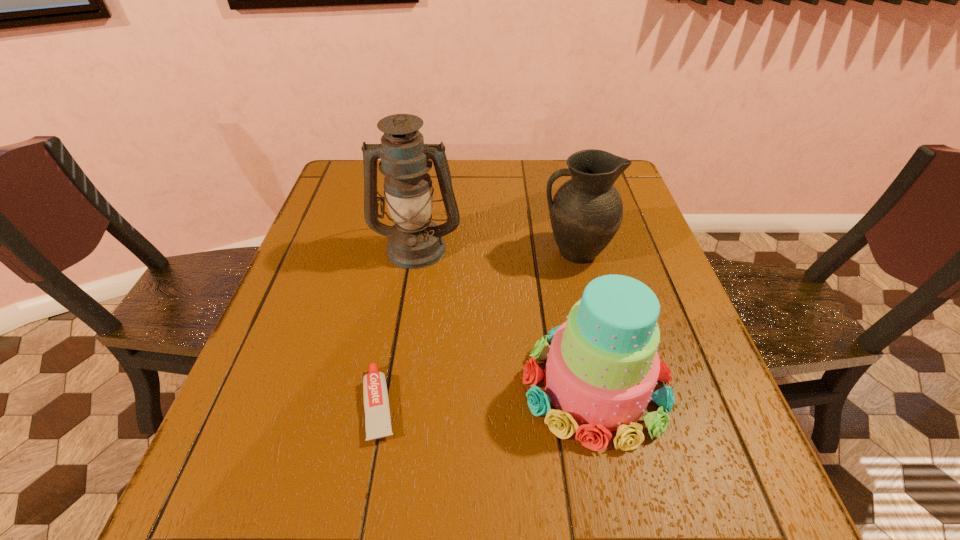
Where is `pitcher that is at the right edge`? Image resolution: width=960 pixels, height=540 pixels. pitcher that is at the right edge is located at coordinates (586, 211).

The image size is (960, 540). Find the location of `cake located in the right edge section of the desktop`. cake located in the right edge section of the desktop is located at coordinates (602, 366).

This screenshot has width=960, height=540. Find the location of `vacant region at the far edge`. vacant region at the far edge is located at coordinates (514, 197).

Locate an element on the screen. vacant position at the near edge of the desktop is located at coordinates (485, 520).

Where is `vacant space at the left edge of the desktop`? vacant space at the left edge of the desktop is located at coordinates (329, 365).

Where is `free space at the right edge of the desktop`? Image resolution: width=960 pixels, height=540 pixels. free space at the right edge of the desktop is located at coordinates (x=638, y=278).

In order to click on blank area at the far left corner in this screenshot , I will do `click(379, 180)`.

Image resolution: width=960 pixels, height=540 pixels. In order to click on vacant space at the near right corner of the desktop in this screenshot , I will do `click(722, 496)`.

I want to click on free point between the pitcher and the tallest object, so click(495, 249).

This screenshot has height=540, width=960. Find the location of `vacant region between the tallest object and the shortest object`. vacant region between the tallest object and the shortest object is located at coordinates (398, 326).